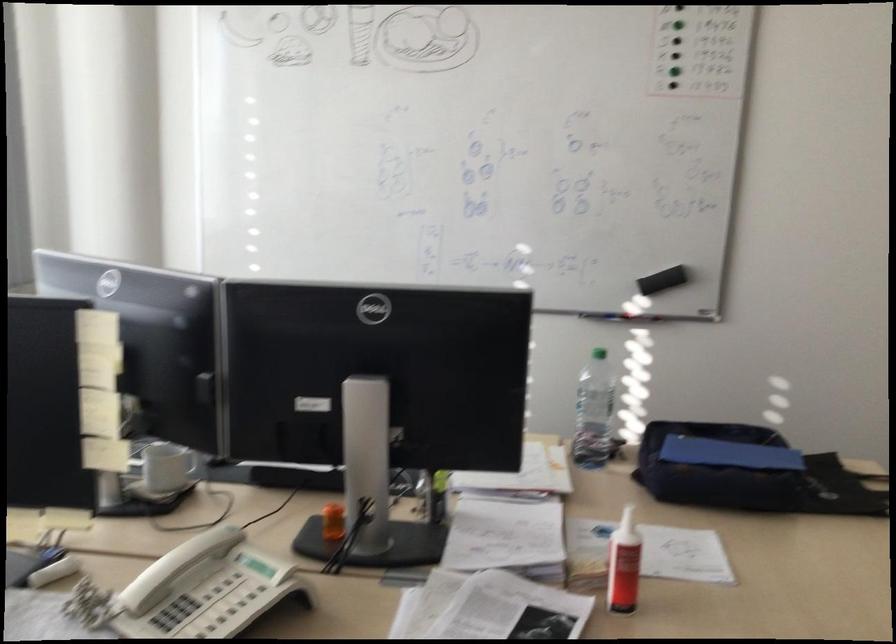
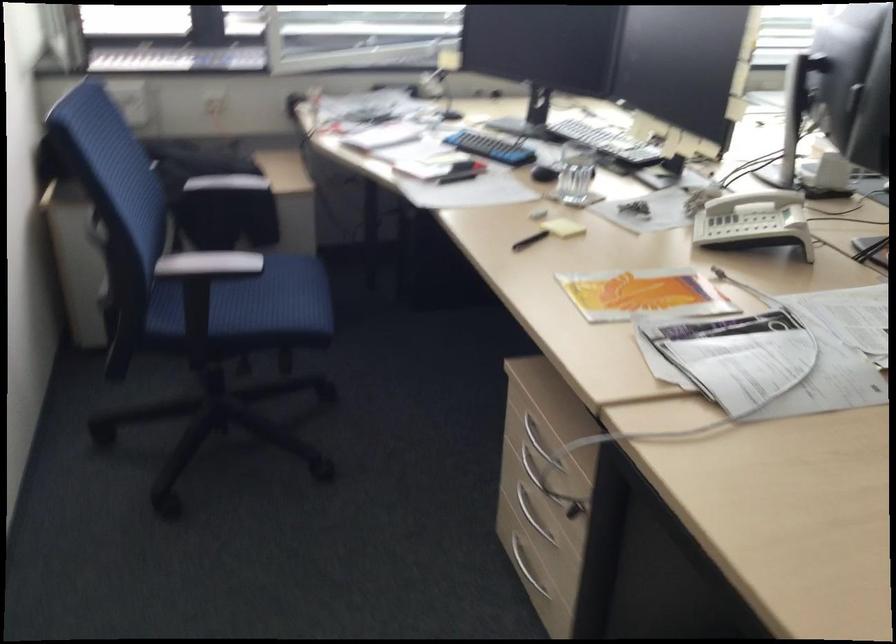
Where in the second image is the point corresponding to point (168, 565) from the first image?

(753, 200)